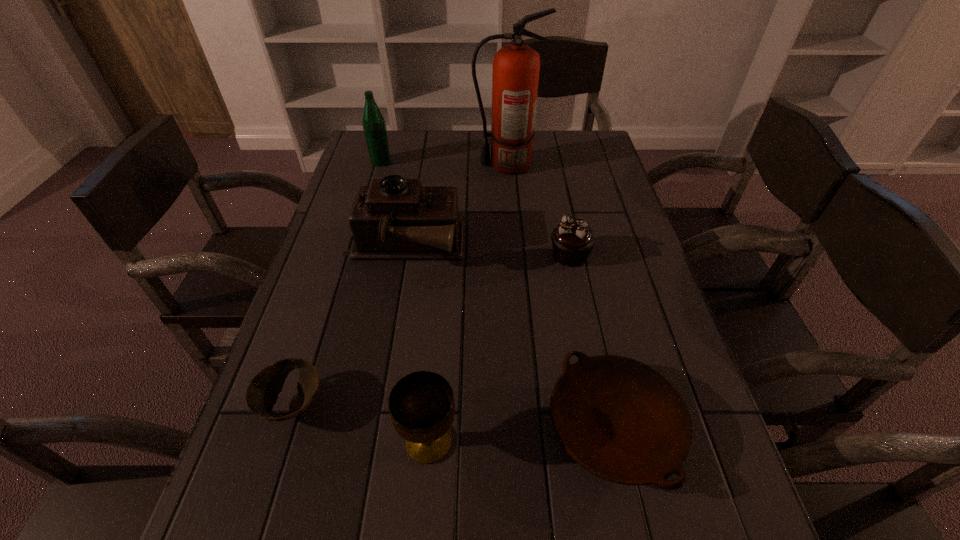
This screenshot has height=540, width=960. Find the location of `bowl positioned at the left edge`. bowl positioned at the left edge is located at coordinates (262, 392).

The image size is (960, 540). I want to click on cupcake that is at the right edge, so click(572, 240).

At what (x,y) coordinates should I click in order to perform the action: click on plate situated at the right edge. Please return your answer as a coordinate pair (x, y). This screenshot has width=960, height=540. Looking at the image, I should click on (619, 419).

At what (x,y) coordinates should I click in order to perform the action: click on object at the far left corner. Please return your answer as a coordinate pair (x, y). This screenshot has width=960, height=540. Looking at the image, I should click on (374, 125).

Locate an element on the screen. The width and height of the screenshot is (960, 540). free space at the far edge is located at coordinates (417, 143).

Where is `vacant space at the left edge of the desktop`? The height and width of the screenshot is (540, 960). vacant space at the left edge of the desktop is located at coordinates (311, 301).

You are a GUI agent. You are given a task and a screenshot of the screen. Output one action in this format:
    pyautogui.click(x=<x>, y=<y>)
    Task: Click on the blank space at the right edge of the desktop
    The width and height of the screenshot is (960, 540).
    Given the screenshot: What is the action you would take?
    pyautogui.click(x=596, y=227)

The width and height of the screenshot is (960, 540). Find the location of `vacant region at the far left corner of the desktop`. vacant region at the far left corner of the desktop is located at coordinates (358, 155).

This screenshot has width=960, height=540. Find the location of `free region at the far right corner of the desktop`. free region at the far right corner of the desktop is located at coordinates (564, 154).

This screenshot has height=540, width=960. I want to click on free space that is in between the fourth shortest object and the second tallest object, so click(405, 301).